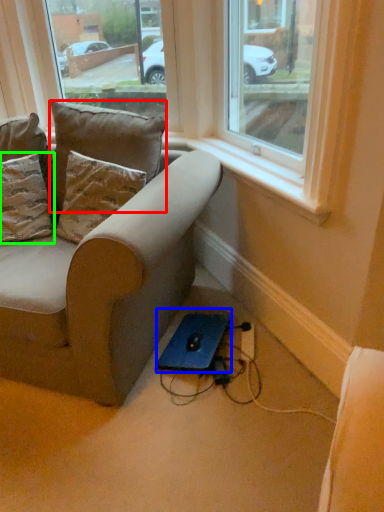
Question: Considering the real-world distances, which object is closest to pillow (highlighted by a red box)? computer (highlighted by a blue box) or pillow (highlighted by a green box).

Choices:
 (A) computer
 (B) pillow

Answer: (B)